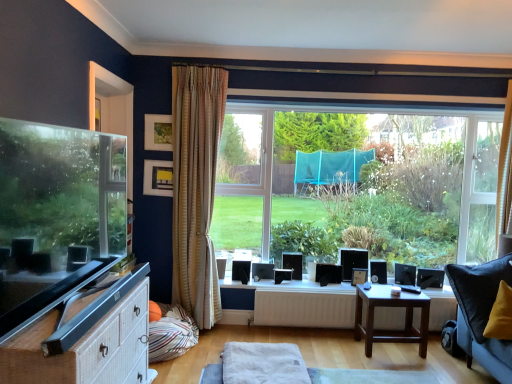
I want to click on vacant point to the right of striped fabric pillow at lower left, so click(x=220, y=343).